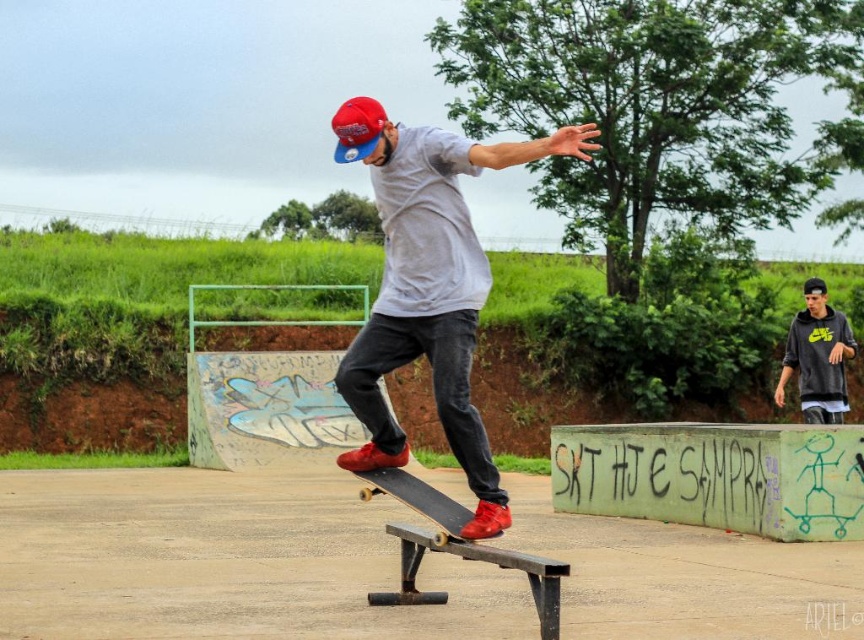
Question: Which of the following is the closest to the observer?

Choices:
 (A) dark gray hoodie at right
 (B) black matte skateboard at center

Answer: (B)

Question: Can you confirm if dark gray hoodie at right is smaller than black matte skateboard at center?

Choices:
 (A) yes
 (B) no

Answer: (B)

Question: Which object is the closest to the black matte skateboard at center?

Choices:
 (A) matte red sneakers at center
 (B) dark gray hoodie at right

Answer: (A)

Question: Does dark gray hoodie at right have a lesser width compared to black matte skateboard at center?

Choices:
 (A) no
 (B) yes

Answer: (A)

Question: From the image, what is the correct spatial relationship of matte red sneakers at center in relation to dark gray hoodie at right?

Choices:
 (A) left
 (B) right

Answer: (A)

Question: Estimate the real-world distances between objects in this image. Which object is farther from the matte red sneakers at center?

Choices:
 (A) dark gray hoodie at right
 (B) black matte skateboard at center

Answer: (A)